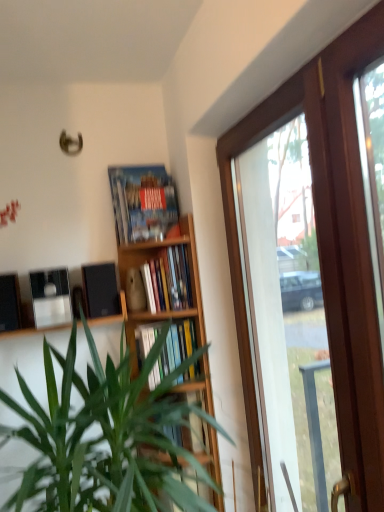
Question: Is matte black shelf at center, acting as the second shelf starting from the bottom, situated inside black matte speaker at left, which ranks as the 2th loudspeaker in right-to-left order, or outside?

Choices:
 (A) inside
 (B) outside

Answer: (B)

Question: Looking at the image, does matte black shelf at center, acting as the second shelf starting from the bottom, seem bigger or smaller compared to black matte speaker at left, which ranks as the 2th loudspeaker in right-to-left order?

Choices:
 (A) big
 (B) small

Answer: (A)

Question: Estimate the real-world distances between objects in this image. Which object is farther from the black matte speaker at left, which ranks as the 2th loudspeaker in right-to-left order?

Choices:
 (A) black matte speaker at lower left, which is the second loudspeaker from left to right
 (B) hardcover books at center, acting as the second book starting from the top
 (C) wooden frame at right
 (D) matte black shelf at center, the first shelf when ordered from top to bottom
 (E) hardcover book at center, which is the 3th book from top to bottom

Answer: (C)

Question: Which object is the closest to the green leafy plant at center?

Choices:
 (A) wooden frame at right
 (B) matte black shelf at center, the 1th shelf when ordered from left to right
 (C) wooden bookshelf at center, which appears as the first shelf when ordered from the bottom
 (D) hardcover book at upper center, which is counted as the first book, starting from the top
 (E) hardcover books at center, which appears as the 2th book when ordered from the bottom

Answer: (C)